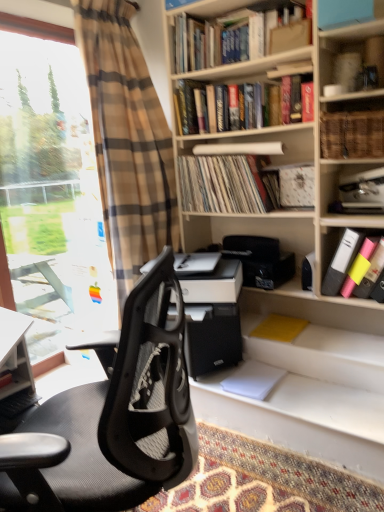
Question: In terms of size, does matte vinyl records at center, which ranks as the 4th book in top-to-bottom order, appear bigger or smaller than hardcover books at upper center, arranged as the 1th book when viewed from the top?

Choices:
 (A) big
 (B) small

Answer: (B)

Question: Choose the correct answer: Is matte vinyl records at center, which ranks as the 4th book in top-to-bottom order, inside hardcover books at upper center, arranged as the 1th book when viewed from the top, or outside it?

Choices:
 (A) inside
 (B) outside

Answer: (B)

Question: Which object is the farthest from the matte vinyl records at center, marked as the third book in a bottom-to-top arrangement?

Choices:
 (A) hardcover books at upper center, placed as the 6th book when sorted from bottom to top
 (B) yellow matte paper at lower right, placed as the first paperback book when sorted from top to bottom
 (C) white matte printer at center
 (D) woven wicker basket at upper right, which appears as the 3th book when viewed from the top
 (E) hardcover book at upper center, the 2th book in the top-to-bottom sequence

Answer: (B)

Question: Based on their relative distances, which object is nearer to the matte vinyl records at center, marked as the third book in a bottom-to-top arrangement?

Choices:
 (A) white paper at lower center, the 2th paperback book positioned from the top
 (B) transparent glass window at left
 (C) woven wicker basket at upper right, positioned as the 4th book in bottom-to-top order
 (D) black mesh office chair at left
 (E) plaid fabric curtain at left

Answer: (E)